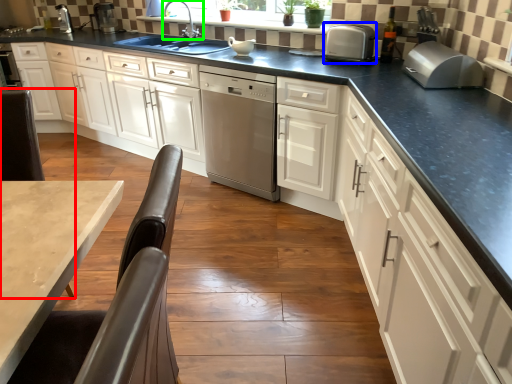
Question: Estimate the real-world distances between objects in this image. Which object is farther from chair (highlighted by a red box), kitchen appliance (highlighted by a blue box) or tap (highlighted by a green box)?

Choices:
 (A) kitchen appliance
 (B) tap

Answer: (B)